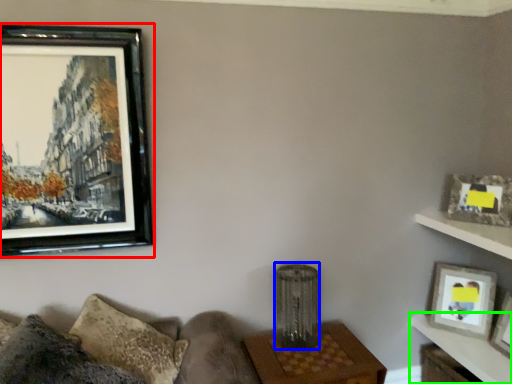
Question: Which is farther away from picture frame (highlighted by a red box)? lamp (highlighted by a blue box) or table (highlighted by a green box)?

Choices:
 (A) lamp
 (B) table

Answer: (B)